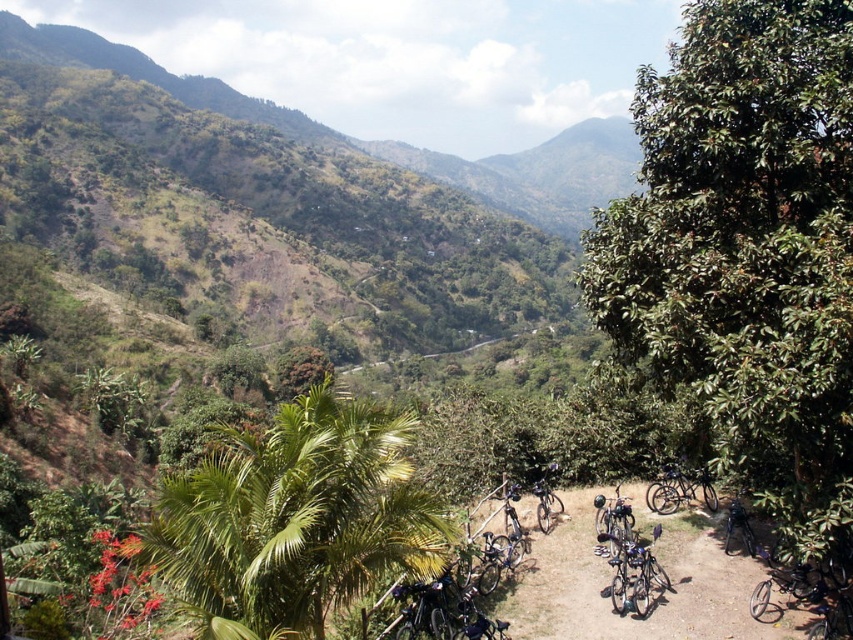
Can you confirm if green leafy tree at right is bigger than shiny metallic bicycle at center-right?

Correct, green leafy tree at right is larger in size than shiny metallic bicycle at center-right.

Who is more forward, (x=717, y=435) or (x=670, y=490)?

Point (x=717, y=435)

What are the coordinates of `green leafy tree at right` in the screenshot? It's located at (747, 252).

Can you confirm if green leafy palm at center is smaller than shiny metallic bicycle at center-right?

Incorrect, green leafy palm at center is not smaller in size than shiny metallic bicycle at center-right.

This screenshot has height=640, width=853. I want to click on green leafy palm at center, so click(294, 518).

What are the coordinates of `green leafy palm at center` in the screenshot? It's located at (294, 518).

At what (x,y) coordinates should I click in order to perform the action: click on green leafy palm at center. Please return your answer as a coordinate pair (x, y). The width and height of the screenshot is (853, 640). Looking at the image, I should click on (294, 518).

Between green leafy tree at right and metallic silver bicycles at lower right, which one is positioned lower?

Positioned lower is metallic silver bicycles at lower right.

What do you see at coordinates (747, 252) in the screenshot? The height and width of the screenshot is (640, 853). I see `green leafy tree at right` at bounding box center [747, 252].

Image resolution: width=853 pixels, height=640 pixels. I want to click on green leafy tree at right, so click(747, 252).